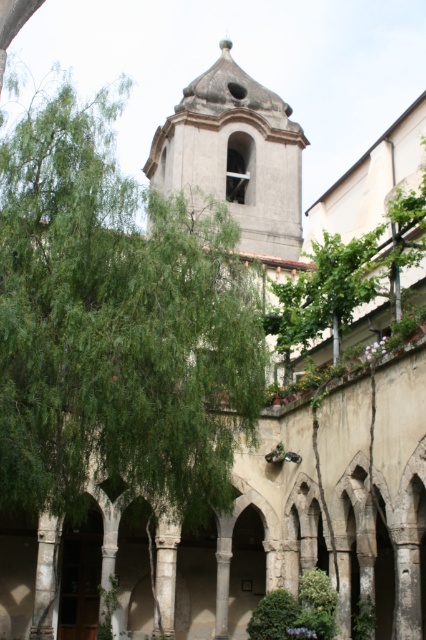
Question: Which of the following is the closest to the observer?

Choices:
 (A) gray stone bell tower at center
 (B) green leafy tree at center

Answer: (B)

Question: Is green leafy tree at center wider than gray stone bell tower at center?

Choices:
 (A) no
 (B) yes

Answer: (A)

Question: Where is green leafy tree at center located in relation to gray stone bell tower at center in the image?

Choices:
 (A) below
 (B) above

Answer: (A)

Question: Which of the following is the closest to the observer?

Choices:
 (A) gray stone bell tower at center
 (B) green leafy tree at center

Answer: (B)

Question: Does green leafy tree at center appear on the left side of gray stone bell tower at center?

Choices:
 (A) no
 (B) yes

Answer: (B)